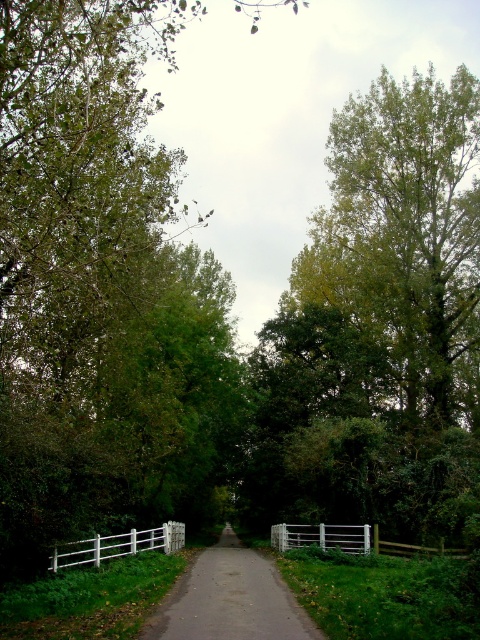
You are standing at the point marked as point (229, 600) in the image. What is the surface material under your feet?

The surface material at point (229, 600) is smooth asphalt driveway at center.

You are a gardener who needs to trim the white wooden fence at center and the white wooden fence at lower left. Based on the scene, which fence requires you to use a ladder to reach its top?

The white wooden fence at lower left requires a ladder because it is taller than the white wooden fence at center.

You are a gardener planning to paint the fences along the path. You have enough paint to cover 10 square meters. The white wooden fence at center and the white wooden fence at lower left need painting. Which fence requires more paint based on their size?

The white wooden fence at center requires more paint because it is bigger than the white wooden fence at lower left.